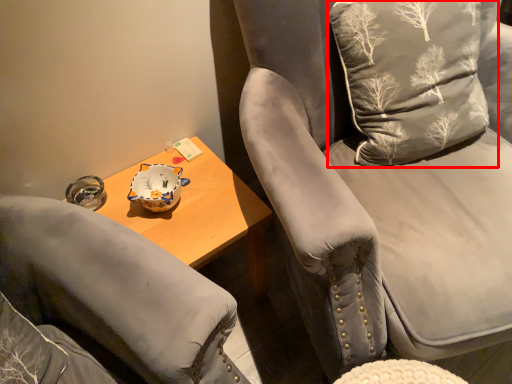
Question: From the image's perspective, where is throw pillow (annotated by the red box) located relative to chair?

Choices:
 (A) above
 (B) below

Answer: (A)